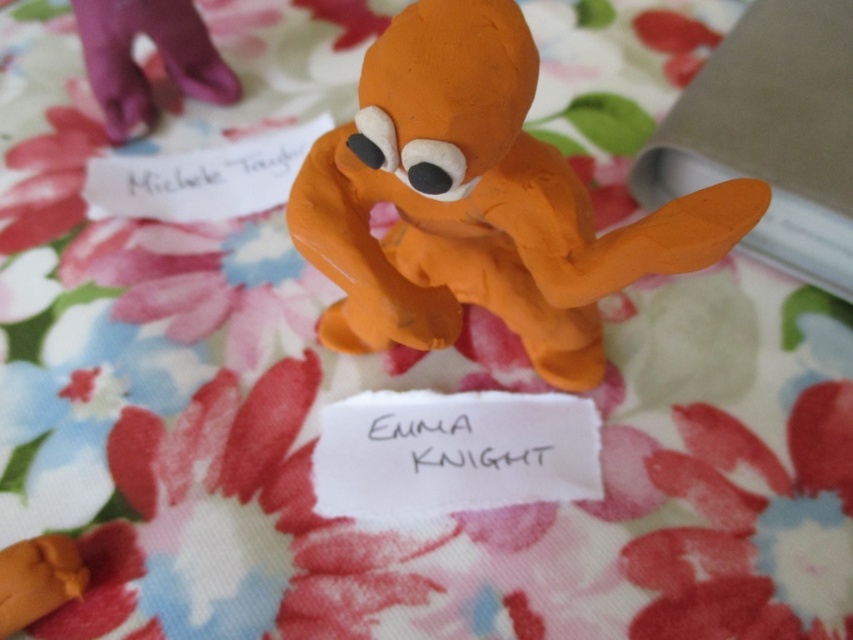
Is orange clay dog at center shorter than matte white paper at upper left?

In fact, orange clay dog at center may be taller than matte white paper at upper left.

Is point (468, 180) positioned in front of point (262, 152)?

Yes, it is.

Which is in front, point (461, 204) or point (193, 195)?

Point (461, 204)

Where is `orange clay dog at center`? orange clay dog at center is located at coordinates (479, 202).

Does orange clay dog at center appear under black paper at center?

Actually, orange clay dog at center is above black paper at center.

Between orange clay dog at center and black paper at center, which one is positioned lower?

Positioned lower is black paper at center.

The image size is (853, 640). Describe the element at coordinates (479, 202) in the screenshot. I see `orange clay dog at center` at that location.

Locate an element on the screen. This screenshot has height=640, width=853. orange clay dog at center is located at coordinates (479, 202).

Does black paper at center appear over matte white paper at upper left?

Incorrect, black paper at center is not positioned above matte white paper at upper left.

Can you confirm if black paper at center is thinner than matte white paper at upper left?

Indeed, black paper at center has a lesser width compared to matte white paper at upper left.

Between point (373, 412) and point (286, 188), which one is positioned behind?

Positioned behind is point (286, 188).

Where is `black paper at center`? The width and height of the screenshot is (853, 640). black paper at center is located at coordinates (462, 438).